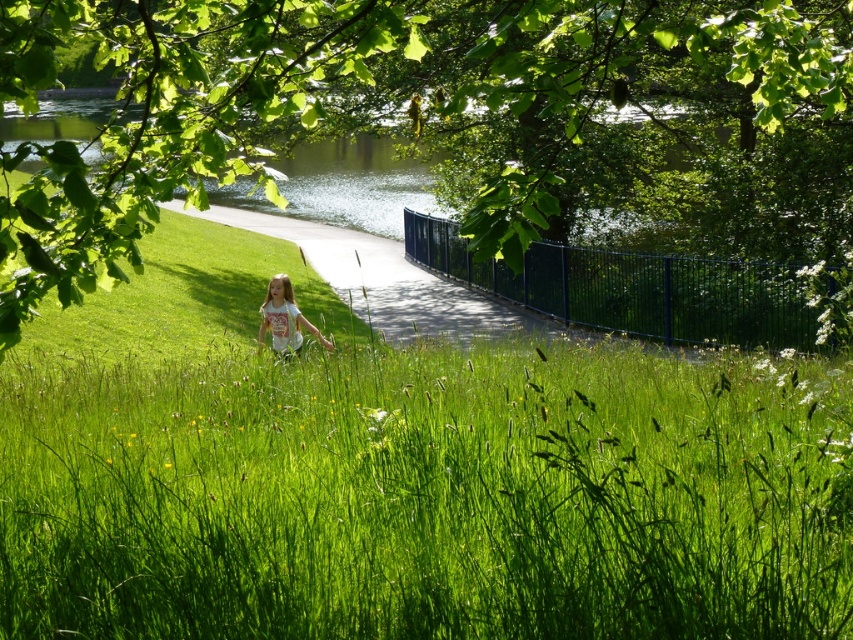
Who is more forward, (461, 577) or (285, 326)?

Point (461, 577) is in front.

Between green grassy at center and white cotton shirt at center, which one appears on the right side from the viewer's perspective?

Positioned to the right is green grassy at center.

I want to click on green grassy at center, so click(427, 497).

Does green grassy at center have a smaller size compared to green leafy tree at upper center?

Yes, green grassy at center is smaller than green leafy tree at upper center.

Which is above, green grassy at center or green leafy tree at upper center?

green leafy tree at upper center

Does point (405, 508) lie behind point (312, 17)?

No, (405, 508) is in front of (312, 17).

Where is `green grassy at center`? green grassy at center is located at coordinates (427, 497).

This screenshot has height=640, width=853. Find the location of `green leafy tree at upper center`. green leafy tree at upper center is located at coordinates (349, 88).

Locate an element on the screen. The height and width of the screenshot is (640, 853). green leafy tree at upper center is located at coordinates (349, 88).